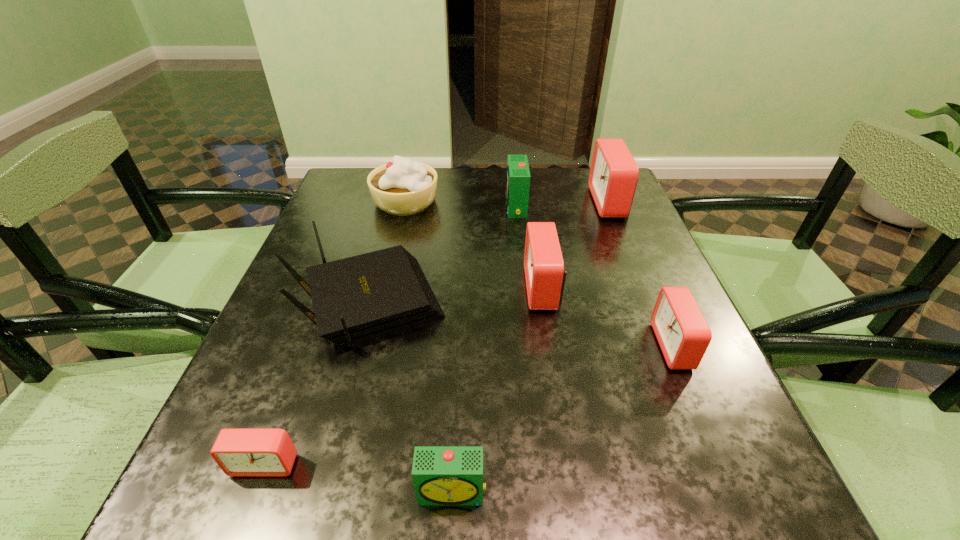
You are a GUI agent. You are given a task and a screenshot of the screen. Output one action in this format:
    pyautogui.click(x=<x>, y=<y>)
    Task: Click on the vacant space located on the front-facing side of the bigger green alarm clock
    The width and height of the screenshot is (960, 540).
    Given the screenshot: What is the action you would take?
    pyautogui.click(x=471, y=206)

Locate an element on the screen. The height and width of the screenshot is (540, 960). vacant space located on the front-facing side of the bigger green alarm clock is located at coordinates (468, 206).

At what (x,y) coordinates should I click in order to perform the action: click on vacant space situated 0.240m on the front-facing side of the third smallest red alarm clock. Please return your answer as a coordinate pair (x, y). This screenshot has height=540, width=960. Looking at the image, I should click on (408, 288).

Locate an element on the screen. The image size is (960, 540). free location located 0.190m on the front-facing side of the third smallest red alarm clock is located at coordinates (432, 288).

I want to click on free space located on the front-facing side of the third smallest red alarm clock, so pyautogui.click(x=437, y=288).

Locate an element on the screen. This screenshot has height=540, width=960. free location located on the front-facing side of the third nearest alarm clock is located at coordinates (551, 346).

Identify the location of free space located on the front-facing side of the third nearest alarm clock. (545, 346).

You are a GUI agent. You are given a task and a screenshot of the screen. Output one action in this format:
    pyautogui.click(x=<x>, y=<y>)
    Task: Click on the free space located on the front-facing side of the third nearest alarm clock
    The image size is (960, 540).
    Given the screenshot: What is the action you would take?
    pyautogui.click(x=557, y=346)

In order to click on vacant space located on the front-facing side of the leftmost red alarm clock in this screenshot , I will do `click(242, 525)`.

Where is `whipped cream at the far edge`? This screenshot has height=540, width=960. whipped cream at the far edge is located at coordinates pos(402,187).